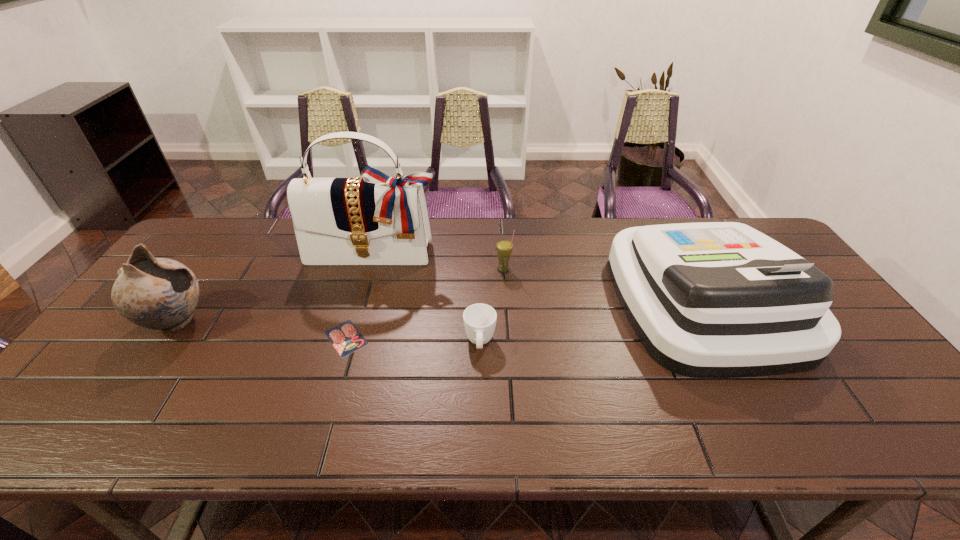
At what (x,y) coordinates should I click in order to perform the action: click on unoccupied area between the salami and the pottery. Please return your answer as a coordinate pair (x, y). The height and width of the screenshot is (540, 960). Looking at the image, I should click on (261, 330).

The height and width of the screenshot is (540, 960). Identify the location of free space between the third object from right to left and the fifth object from left to right. (492, 306).

Find the location of a particular element. This screenshot has height=540, width=960. blank region between the rightmost object and the pottery is located at coordinates (440, 312).

Choose which object is the fifth nearest neighbor to the third shortest object. Please provide its 2D coordinates. Your answer should be formatted as a tuple, i.e. [(x, y)], where the tuple contains the x and y coordinates of a point satisfying the conditions above.

[(161, 294)]

Choose which object is the third nearest neighbor to the third shortest object. Please provide its 2D coordinates. Your answer should be formatted as a tuple, i.e. [(x, y)], where the tuple contains the x and y coordinates of a point satisfying the conditions above.

[(714, 299)]

Locate an element on the screen. The image size is (960, 540). free location that satisfies the following two spatial constraints: 1. from the spout of the shortest object; 2. on the left side of the pottery is located at coordinates (164, 338).

The height and width of the screenshot is (540, 960). I want to click on free point that satisfies the following two spatial constraints: 1. on the front-facing side of the satchel; 2. on the left side of the straw for drinking, so [369, 269].

Identify the location of vacant space that satisfies the following two spatial constraints: 1. on the front side of the fourth tallest object; 2. on the right side of the cash register. (506, 301).